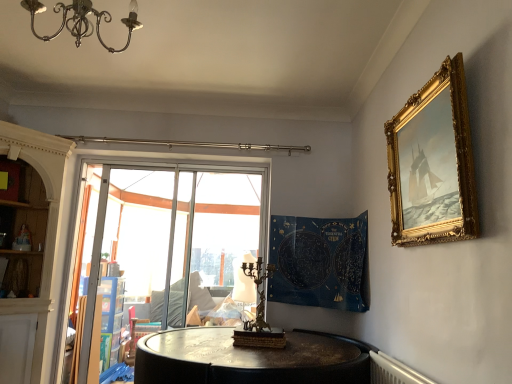
Question: Can you confirm if bronze/copper candle holder at center is positioned to the right of transparent glass window at center?

Choices:
 (A) no
 (B) yes

Answer: (B)

Question: From a real-world perspective, is bronze/copper candle holder at center on transparent glass window at center?

Choices:
 (A) no
 (B) yes

Answer: (A)

Question: Are bronze/copper candle holder at center and transparent glass window at center beside each other?

Choices:
 (A) no
 (B) yes

Answer: (A)

Question: Would you say bronze/copper candle holder at center is a long distance from transparent glass window at center?

Choices:
 (A) no
 (B) yes

Answer: (B)

Question: From a real-world perspective, is bronze/copper candle holder at center under transparent glass window at center?

Choices:
 (A) no
 (B) yes

Answer: (B)

Question: From the image's perspective, relative to transparent plastic at center, is bronze/copper candle holder at center above or below?

Choices:
 (A) below
 (B) above

Answer: (A)

Question: Is bronze/copper candle holder at center wider or thinner than transparent plastic at center?

Choices:
 (A) thin
 (B) wide

Answer: (B)

Question: In terms of height, does bronze/copper candle holder at center look taller or shorter compared to transparent plastic at center?

Choices:
 (A) tall
 (B) short

Answer: (B)

Question: Is bronze/copper candle holder at center bigger or smaller than transparent plastic at center?

Choices:
 (A) big
 (B) small

Answer: (B)

Question: From a real-world perspective, is metallic chandelier at upper left physically located above or below blue fabric tapestry at center?

Choices:
 (A) above
 (B) below

Answer: (A)

Question: Visually, is metallic chandelier at upper left positioned to the left or to the right of blue fabric tapestry at center?

Choices:
 (A) right
 (B) left

Answer: (B)

Question: From the image's perspective, relative to blue fabric tapestry at center, is metallic chandelier at upper left above or below?

Choices:
 (A) below
 (B) above

Answer: (B)

Question: Considering the positions of metallic chandelier at upper left and blue fabric tapestry at center in the image, is metallic chandelier at upper left wider or thinner than blue fabric tapestry at center?

Choices:
 (A) thin
 (B) wide

Answer: (A)

Question: Considering the positions of transparent glass window at center and blue fabric tapestry at center in the image, is transparent glass window at center bigger or smaller than blue fabric tapestry at center?

Choices:
 (A) small
 (B) big

Answer: (A)

Question: Considering their positions, is transparent glass window at center located in front of or behind blue fabric tapestry at center?

Choices:
 (A) behind
 (B) front

Answer: (A)